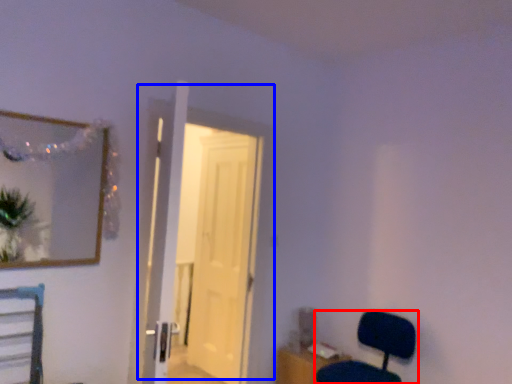
Question: Among these objects, which one is farthest to the camera, chair (highlighted by a red box) or door (highlighted by a blue box)?

Choices:
 (A) chair
 (B) door

Answer: (B)